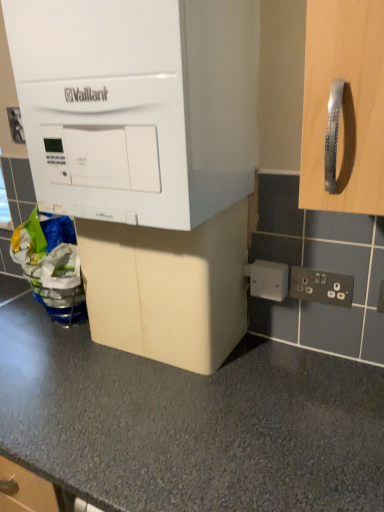
Question: Is black plastic electrical outlet at lower right, marked as the 1th electric outlet in a right-to-left arrangement, in contact with white plastic electric outlet at upper left, which appears as the 1th electric outlet when viewed from the back?

Choices:
 (A) yes
 (B) no

Answer: (B)

Question: Is black plastic electrical outlet at lower right, marked as the 1th electric outlet in a right-to-left arrangement, positioned behind white plastic electric outlet at upper left, which is counted as the 1th electric outlet, starting from the top?

Choices:
 (A) no
 (B) yes

Answer: (A)

Question: Does black plastic electrical outlet at lower right, acting as the 3th electric outlet starting from the back, appear on the right side of white plastic electric outlet at upper left, positioned as the 3th electric outlet in front-to-back order?

Choices:
 (A) yes
 (B) no

Answer: (A)

Question: Are black plastic electrical outlet at lower right, which ranks as the 3th electric outlet in left-to-right order, and white plastic electric outlet at upper left, the 3th electric outlet when ordered from bottom to top, far apart?

Choices:
 (A) yes
 (B) no

Answer: (A)

Question: Is black plastic electrical outlet at lower right, which ranks as the 3th electric outlet in left-to-right order, oriented away from white plastic electric outlet at upper left, positioned as the 3th electric outlet in front-to-back order?

Choices:
 (A) yes
 (B) no

Answer: (B)

Question: Relative to white plastic electric outlet at upper left, acting as the first electric outlet starting from the left, is white matte vaillant boiler at upper left, the second cabinetry when ordered from bottom to top, in front or behind?

Choices:
 (A) behind
 (B) front

Answer: (B)

Question: From a real-world perspective, is white matte vaillant boiler at upper left, arranged as the first cabinetry when viewed from the top, above or below white plastic electric outlet at upper left, the 3th electric outlet positioned from the right?

Choices:
 (A) below
 (B) above

Answer: (B)

Question: From the image's perspective, is white matte vaillant boiler at upper left, arranged as the first cabinetry when viewed from the top, above or below white plastic electric outlet at upper left, acting as the first electric outlet starting from the left?

Choices:
 (A) below
 (B) above

Answer: (A)

Question: Does point (178, 7) appear closer or farther from the camera than point (14, 138)?

Choices:
 (A) farther
 (B) closer

Answer: (B)

Question: Is white plastic electric outlet at upper left, acting as the first electric outlet starting from the left, wider or thinner than black plastic electrical outlet at lower right, arranged as the 3th electric outlet when viewed from the top?

Choices:
 (A) thin
 (B) wide

Answer: (B)

Question: In the image, is white plastic electric outlet at upper left, which appears as the 1th electric outlet when viewed from the back, on the left side or the right side of black plastic electrical outlet at lower right, the first electric outlet from the bottom?

Choices:
 (A) left
 (B) right

Answer: (A)

Question: Considering the positions of white plastic electric outlet at upper left, the 3th electric outlet when ordered from bottom to top, and black plastic electrical outlet at lower right, marked as the 1th electric outlet in a right-to-left arrangement, in the image, is white plastic electric outlet at upper left, the 3th electric outlet when ordered from bottom to top, taller or shorter than black plastic electrical outlet at lower right, marked as the 1th electric outlet in a right-to-left arrangement,?

Choices:
 (A) tall
 (B) short

Answer: (A)

Question: From a real-world perspective, is white plastic electric outlet at upper left, positioned as the 3th electric outlet in front-to-back order, positioned above or below black plastic electrical outlet at lower right, which appears as the first electric outlet when viewed from the front?

Choices:
 (A) above
 (B) below

Answer: (A)

Question: Choose the correct answer: Is white matte vaillant boiler at upper left, the second cabinetry when ordered from bottom to top, inside beige matte cabinet at center, which appears as the 2th cabinetry when viewed from the top, or outside it?

Choices:
 (A) inside
 (B) outside

Answer: (B)

Question: From a real-world perspective, is white matte vaillant boiler at upper left, the second cabinetry when ordered from bottom to top, above or below beige matte cabinet at center, acting as the 1th cabinetry starting from the bottom?

Choices:
 (A) below
 (B) above

Answer: (B)